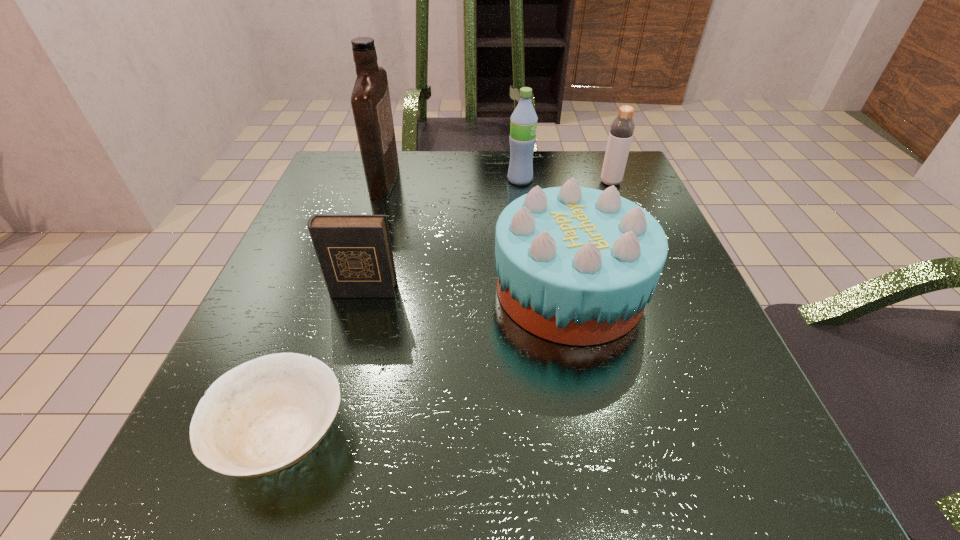
Locate an element on the screen. This screenshot has height=540, width=960. vacant space at the near left corner is located at coordinates pos(197,471).

Identify the location of free space at the far right corner of the desktop. (651, 204).

Find the location of a particular element. The image size is (960, 540). free space at the near right corner is located at coordinates (764, 446).

The width and height of the screenshot is (960, 540). In order to click on free point between the cake and the tallest object in this screenshot , I will do point(477,234).

Locate an element on the screen. empty space between the bottle and the fifth shortest object is located at coordinates (565, 181).

Locate an element on the screen. This screenshot has height=540, width=960. free area in between the water bottle and the tallest object is located at coordinates (452, 179).

Where is `free space between the fifth shortest object and the shortest object`? This screenshot has width=960, height=540. free space between the fifth shortest object and the shortest object is located at coordinates (402, 307).

This screenshot has width=960, height=540. In order to click on free area in between the water bottle and the bottle in this screenshot , I will do `click(565, 181)`.

Identify the location of free spot between the cake and the diary. (467, 290).

Choose which object is the second nearest neighbor to the cake. Please provide its 2D coordinates. Your answer should be formatted as a tuple, i.e. [(x, y)], where the tuple contains the x and y coordinates of a point satisfying the conditions above.

[(622, 128)]